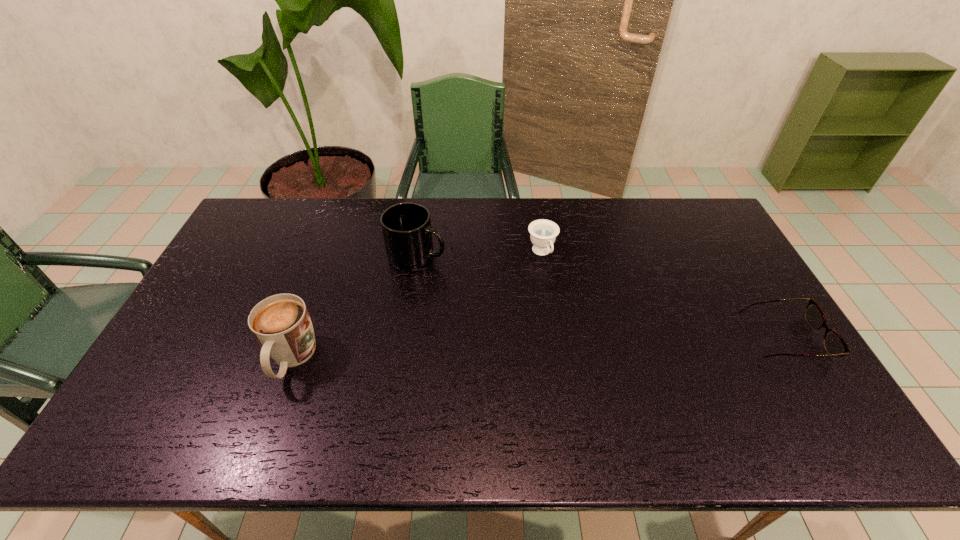
Where is `object that is the third closest to the teacup`? object that is the third closest to the teacup is located at coordinates (281, 323).

Identify which object is the second closest to the leftmost object. Please provide its 2D coordinates. Your answer should be formatted as a tuple, i.e. [(x, y)], where the tuple contains the x and y coordinates of a point satisfying the conditions above.

[(543, 232)]

Identify the location of blank area in the image that satisfies the following two spatial constraints: 1. on the front side of the rightmost object; 2. on the face of the teacup. (554, 338).

I want to click on vacant space that satisfies the following two spatial constraints: 1. on the back side of the third object from left to right; 2. on the left side of the third object from right to left, so click(x=418, y=252).

This screenshot has height=540, width=960. Identify the location of vacant space that satisfies the following two spatial constraints: 1. on the front side of the rightmost object; 2. on the face of the farther mug. (405, 338).

I want to click on vacant region that satisfies the following two spatial constraints: 1. on the front side of the rightmost object; 2. on the face of the second shortest object, so click(x=554, y=338).

The image size is (960, 540). In order to click on vacant space that satisfies the following two spatial constraints: 1. on the front side of the teacup; 2. on the face of the spectacles in this screenshot , I will do `click(554, 338)`.